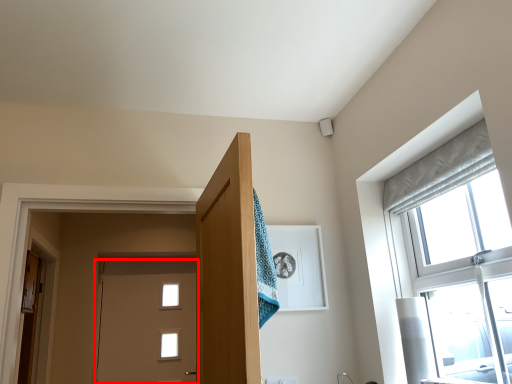
Question: From the image's perspective, where is door (annotated by the red box) located in relation to door in the image?

Choices:
 (A) below
 (B) above

Answer: (A)